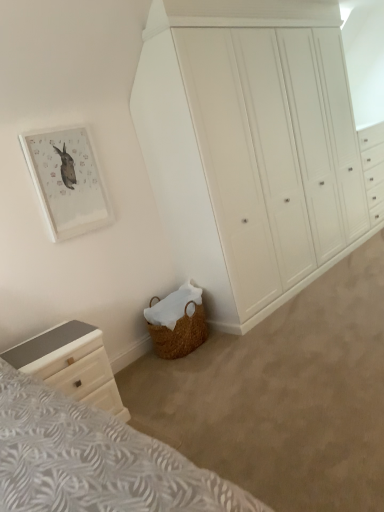
Question: Is white glossy chest of drawers at lower left, the 2th chest of drawers from the right, positioned with its back to white painted wood wardrobe at center, the first chest of drawers viewed from the right?

Choices:
 (A) yes
 (B) no

Answer: (B)

Question: Does white glossy chest of drawers at lower left, which ranks as the first chest of drawers in left-to-right order, come in front of white painted wood wardrobe at center, which is counted as the 1th chest of drawers, starting from the top?

Choices:
 (A) no
 (B) yes

Answer: (B)

Question: Is white glossy chest of drawers at lower left, which is the 1th chest of drawers from front to back, not within white painted wood wardrobe at center, which appears as the 1th chest of drawers when viewed from the back?

Choices:
 (A) no
 (B) yes

Answer: (B)

Question: From a real-world perspective, is white glossy chest of drawers at lower left, the 2th chest of drawers from the right, over white painted wood wardrobe at center, which ranks as the 2th chest of drawers in left-to-right order?

Choices:
 (A) yes
 (B) no

Answer: (B)

Question: From the image's perspective, is white glossy chest of drawers at lower left, which ranks as the first chest of drawers in left-to-right order, located beneath white painted wood wardrobe at center, which ranks as the 2th chest of drawers in left-to-right order?

Choices:
 (A) no
 (B) yes

Answer: (B)

Question: From a real-world perspective, is matte white picture frame at upper left positioned above or below white glossy chest of drawers at lower left, arranged as the 2th chest of drawers when viewed from the back?

Choices:
 (A) below
 (B) above

Answer: (B)

Question: From their relative heights in the image, would you say matte white picture frame at upper left is taller or shorter than white glossy chest of drawers at lower left, arranged as the 2th chest of drawers when viewed from the back?

Choices:
 (A) tall
 (B) short

Answer: (A)

Question: Would you say matte white picture frame at upper left is to the left or to the right of white glossy chest of drawers at lower left, which ranks as the first chest of drawers in left-to-right order, in the picture?

Choices:
 (A) left
 (B) right

Answer: (A)

Question: Is point (29, 161) closer or farther from the camera than point (34, 357)?

Choices:
 (A) farther
 (B) closer

Answer: (A)

Question: Is white painted wood wardrobe at center, which ranks as the 2th chest of drawers in left-to-right order, spatially inside matte white picture frame at upper left, or outside of it?

Choices:
 (A) outside
 (B) inside

Answer: (A)

Question: From a real-world perspective, is white painted wood wardrobe at center, which is counted as the 1th chest of drawers, starting from the top, above or below matte white picture frame at upper left?

Choices:
 (A) below
 (B) above

Answer: (A)

Question: Is point (190, 168) closer or farther from the camera than point (39, 182)?

Choices:
 (A) closer
 (B) farther

Answer: (B)

Question: Considering the positions of white painted wood wardrobe at center, which ranks as the 2th chest of drawers in left-to-right order, and matte white picture frame at upper left in the image, is white painted wood wardrobe at center, which ranks as the 2th chest of drawers in left-to-right order, bigger or smaller than matte white picture frame at upper left?

Choices:
 (A) small
 (B) big

Answer: (B)

Question: From a real-world perspective, is white glossy chest of drawers at lower left, arranged as the 2th chest of drawers when viewed from the back, physically located above or below matte white picture frame at upper left?

Choices:
 (A) below
 (B) above

Answer: (A)

Question: Considering the positions of white glossy chest of drawers at lower left, which ranks as the first chest of drawers in left-to-right order, and matte white picture frame at upper left in the image, is white glossy chest of drawers at lower left, which ranks as the first chest of drawers in left-to-right order, bigger or smaller than matte white picture frame at upper left?

Choices:
 (A) big
 (B) small

Answer: (A)